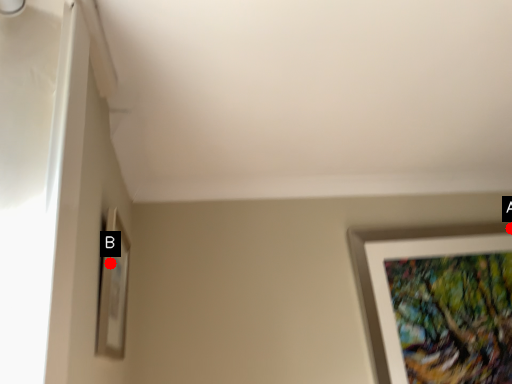
Question: Two points are circled on the image, labeled by A and B beside each circle. Which of the following is the farthest from the observer?

Choices:
 (A) A is further
 (B) B is further

Answer: (A)